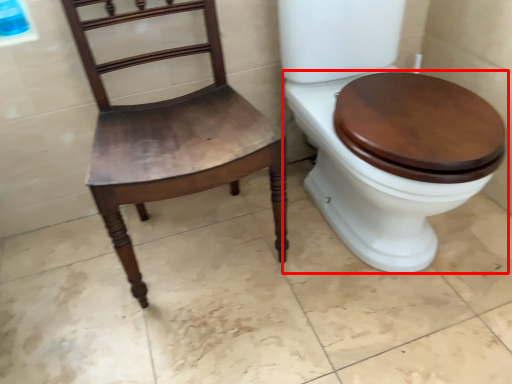
Question: From the image, what is the correct spatial relationship of toilet (annotated by the red box) in relation to chair?

Choices:
 (A) right
 (B) left

Answer: (A)